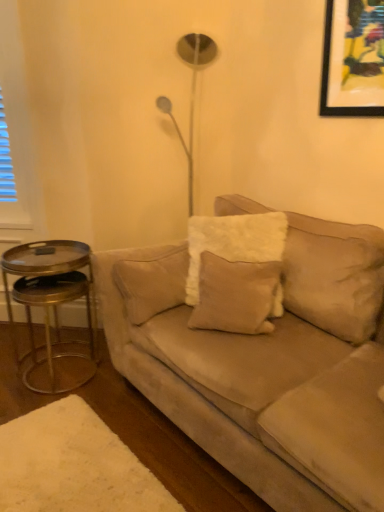
Question: Does beige velvet pillow at center have a greater width compared to suede beige couch at center?

Choices:
 (A) no
 (B) yes

Answer: (A)

Question: Does beige velvet pillow at center appear on the right side of suede beige couch at center?

Choices:
 (A) no
 (B) yes

Answer: (A)

Question: Would you say beige velvet pillow at center is outside suede beige couch at center?

Choices:
 (A) no
 (B) yes

Answer: (A)

Question: Considering the relative sizes of beige velvet pillow at center and suede beige couch at center in the image provided, is beige velvet pillow at center bigger than suede beige couch at center?

Choices:
 (A) yes
 (B) no

Answer: (B)

Question: Considering the relative positions of beige velvet pillow at center and suede beige couch at center in the image provided, is beige velvet pillow at center in front of suede beige couch at center?

Choices:
 (A) no
 (B) yes

Answer: (A)

Question: Can you confirm if beige velvet pillow at center is thinner than suede beige couch at center?

Choices:
 (A) yes
 (B) no

Answer: (A)

Question: From the image's perspective, would you say gold metallic side table at left is shown under beige velvet pillow at center?

Choices:
 (A) no
 (B) yes

Answer: (B)

Question: Is gold metallic side table at left wider than beige velvet pillow at center?

Choices:
 (A) yes
 (B) no

Answer: (A)

Question: Does gold metallic side table at left turn towards beige velvet pillow at center?

Choices:
 (A) no
 (B) yes

Answer: (A)

Question: Is gold metallic side table at left not near beige velvet pillow at center?

Choices:
 (A) no
 (B) yes

Answer: (A)

Question: From the image's perspective, is gold metallic side table at left located above beige velvet pillow at center?

Choices:
 (A) yes
 (B) no

Answer: (B)

Question: From a real-world perspective, does gold metallic side table at left stand above beige velvet pillow at center?

Choices:
 (A) no
 (B) yes

Answer: (A)

Question: Is gold metallic side table at left positioned with its back to suede beige couch at center?

Choices:
 (A) yes
 (B) no

Answer: (B)